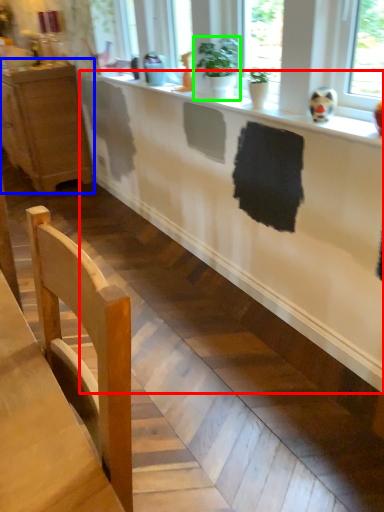
Question: Considering the real-world distances, which object is closest to counter (highlighted by a red box)? cabinetry (highlighted by a blue box) or houseplant (highlighted by a green box).

Choices:
 (A) cabinetry
 (B) houseplant

Answer: (B)